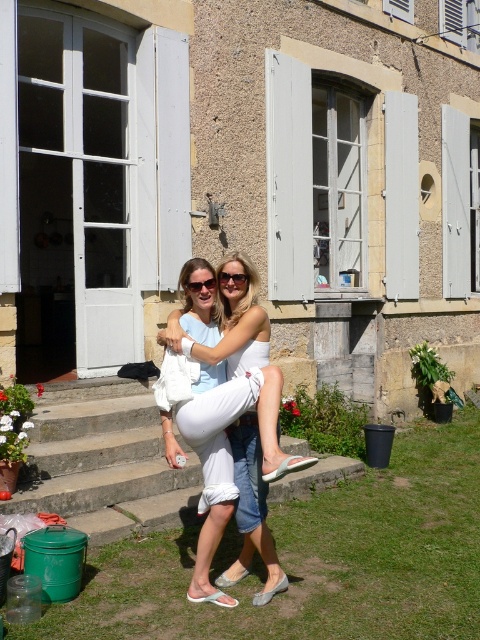
What are the coordinates of the matte white sunglasses at center?

The coordinates of the matte white sunglasses at center are at point (231,276).

You are a fashion designer observing two items in the image. You need to determine which item is bigger between the white cotton shorts at center and the matte white sunglasses at center. Which one is larger?

The white cotton shorts at center has a larger size compared to matte white sunglasses at center, so the white cotton shorts at center is the larger item.